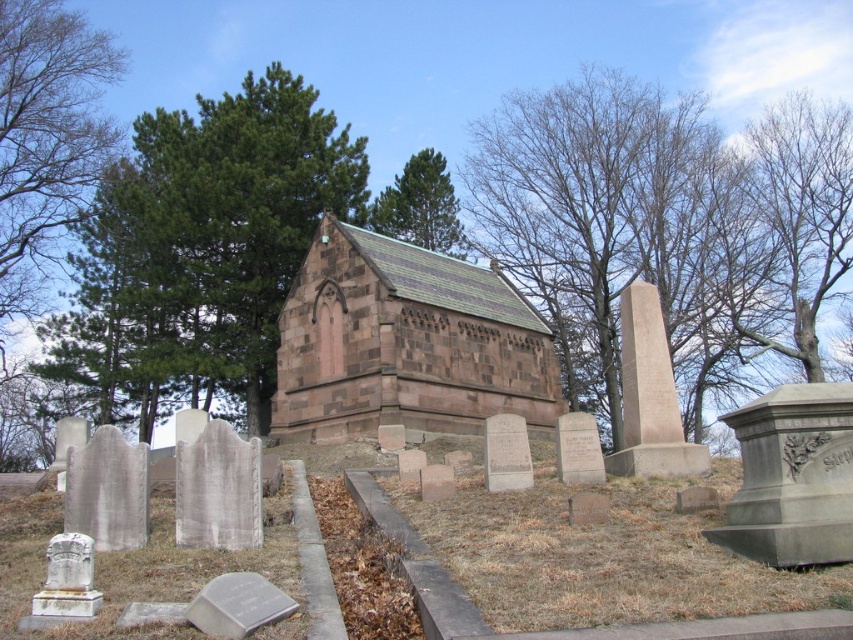
Question: Which point is closer to the camera?

Choices:
 (A) (412, 413)
 (B) (436, 182)

Answer: (A)

Question: Considering the real-world distances, which object is closest to the green leafy tree at upper center?

Choices:
 (A) bare wood tree at upper center
 (B) green leafy tree at upper left
 (C) brown stone church at center

Answer: (B)

Question: Can you confirm if bare wood tree at upper center is thinner than green leafy tree at upper center?

Choices:
 (A) no
 (B) yes

Answer: (A)

Question: Which point is closer to the camera taking this photo?

Choices:
 (A) (505, 332)
 (B) (527, 163)
 (C) (207, 193)

Answer: (A)

Question: Does bare wood tree at upper center come behind brown stone church at center?

Choices:
 (A) yes
 (B) no

Answer: (A)

Question: Is bare wood tree at upper center thinner than green leafy tree at upper left?

Choices:
 (A) yes
 (B) no

Answer: (B)